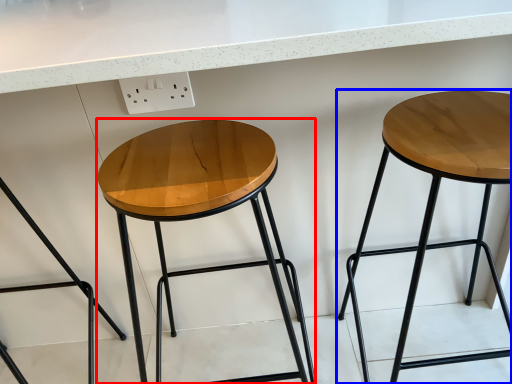
Question: Which of the following is the farthest to the observer, stool (highlighted by a red box) or stool (highlighted by a blue box)?

Choices:
 (A) stool
 (B) stool

Answer: (A)